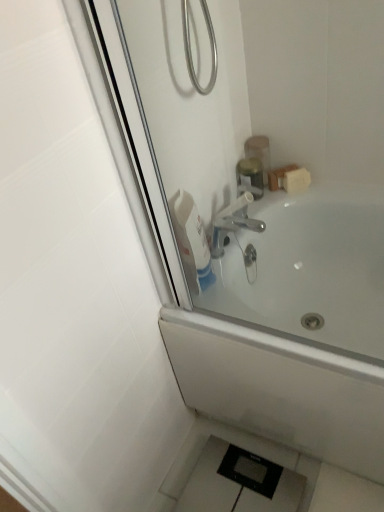
What is the approximate height of white glossy bottle at upper center?

The height of white glossy bottle at upper center is 9.73 inches.

What do you see at coordinates (192, 240) in the screenshot? I see `white glossy bottle at upper center` at bounding box center [192, 240].

Locate an element on the screen. white glossy bathtub at upper center is located at coordinates (295, 329).

Find the location of a particular element. The image size is (384, 512). metallic silver soap dispenser at upper right, which ranks as the second toiletry in top-to-bottom order is located at coordinates (250, 177).

Is white glossy bathtub at upper center further to camera compared to white glossy bottle at upper center?

No, it is not.

Which is behind, point (302, 231) or point (177, 238)?

The point (302, 231) is farther from the camera.

Is white glossy bathtub at upper center with white glossy bottle at upper center?

No, white glossy bathtub at upper center is not next to white glossy bottle at upper center.

Is white glossy bathtub at upper center oriented towards white glossy bottle at upper center?

No, white glossy bathtub at upper center is not turned towards white glossy bottle at upper center.

Which object is closer to the camera taking this photo, white glossy bottle at upper center or metallic gold container at upper center, which is the first toiletry in top-to-bottom order?

white glossy bottle at upper center is in front.

Based on their positions, is white glossy bottle at upper center located to the left or right of metallic gold container at upper center, marked as the second toiletry in a bottom-to-top arrangement?

white glossy bottle at upper center is to the left of metallic gold container at upper center, marked as the second toiletry in a bottom-to-top arrangement.

From the image's perspective, between white glossy bottle at upper center and metallic gold container at upper center, which is the first toiletry in top-to-bottom order, which one is located above?

From the image's view, metallic gold container at upper center, which is the first toiletry in top-to-bottom order, is above.

Which of these two, white glossy bottle at upper center or metallic gold container at upper center, which is the first toiletry in top-to-bottom order, is smaller?

Smaller between the two is metallic gold container at upper center, which is the first toiletry in top-to-bottom order.

Would you say metallic gold container at upper center, marked as the second toiletry in a bottom-to-top arrangement, is outside white glossy bottle at upper center?

That's correct, metallic gold container at upper center, marked as the second toiletry in a bottom-to-top arrangement, is outside of white glossy bottle at upper center.

How many degrees apart are the facing directions of metallic gold container at upper center, which is the first toiletry in top-to-bottom order, and white glossy bottle at upper center?

15.4 degrees.

Who is bigger, metallic gold container at upper center, marked as the second toiletry in a bottom-to-top arrangement, or white glossy bottle at upper center?

white glossy bottle at upper center is bigger.

Relative to white glossy bottle at upper center, is metallic gold container at upper center, marked as the second toiletry in a bottom-to-top arrangement, in front or behind?

In the image, metallic gold container at upper center, marked as the second toiletry in a bottom-to-top arrangement, appears behind white glossy bottle at upper center.

Is metallic silver soap dispenser at upper right, which ranks as the second toiletry in top-to-bottom order, completely or partially inside white glossy bottle at upper center?

Definitely not — metallic silver soap dispenser at upper right, which ranks as the second toiletry in top-to-bottom order, is not inside white glossy bottle at upper center.

Is white glossy bottle at upper center taller than metallic silver soap dispenser at upper right, which ranks as the second toiletry in top-to-bottom order?

Indeed, white glossy bottle at upper center has a greater height compared to metallic silver soap dispenser at upper right, which ranks as the second toiletry in top-to-bottom order.

From a real-world perspective, is white glossy bottle at upper center physically below metallic silver soap dispenser at upper right, arranged as the first toiletry when ordered from the bottom?

No, from a real-world perspective, white glossy bottle at upper center is not below metallic silver soap dispenser at upper right, arranged as the first toiletry when ordered from the bottom.

Is white glossy bottle at upper center directly adjacent to metallic silver soap dispenser at upper right, arranged as the first toiletry when ordered from the bottom?

No, white glossy bottle at upper center is not making contact with metallic silver soap dispenser at upper right, arranged as the first toiletry when ordered from the bottom.

Which of these two, metallic gold container at upper center, which is the first toiletry in top-to-bottom order, or white glossy bathtub at upper center, is wider?

Wider between the two is white glossy bathtub at upper center.

Can we say metallic gold container at upper center, marked as the second toiletry in a bottom-to-top arrangement, lies outside white glossy bathtub at upper center?

A: Yes, metallic gold container at upper center, marked as the second toiletry in a bottom-to-top arrangement, is not within white glossy bathtub at upper center.

Which of these two, metallic gold container at upper center, marked as the second toiletry in a bottom-to-top arrangement, or white glossy bathtub at upper center, is bigger?

With larger size is white glossy bathtub at upper center.

From a real-world perspective, starting from the white glossy bathtub at upper center, which toiletry is the 2nd one vertically above it? Please provide its 2D coordinates.

[(259, 152)]

Considering the positions of objects metallic silver soap dispenser at upper right, arranged as the first toiletry when ordered from the bottom, and white glossy bathtub at upper center in the image provided, who is more to the right, metallic silver soap dispenser at upper right, arranged as the first toiletry when ordered from the bottom, or white glossy bathtub at upper center?

Positioned to the right is white glossy bathtub at upper center.

Does point (251, 188) appear closer or farther from the camera than point (351, 322)?

Point (251, 188).

Would you say metallic silver soap dispenser at upper right, which ranks as the second toiletry in top-to-bottom order, is inside or outside white glossy bathtub at upper center?

metallic silver soap dispenser at upper right, which ranks as the second toiletry in top-to-bottom order, lies outside white glossy bathtub at upper center.

From the image's perspective, who appears lower, metallic silver soap dispenser at upper right, arranged as the first toiletry when ordered from the bottom, or white glossy bathtub at upper center?

white glossy bathtub at upper center, from the image's perspective.

Does metallic silver soap dispenser at upper right, arranged as the first toiletry when ordered from the bottom, appear on the right side of white glossy bottle at upper center?

Correct, you'll find metallic silver soap dispenser at upper right, arranged as the first toiletry when ordered from the bottom, to the right of white glossy bottle at upper center.

From the image's perspective, is metallic silver soap dispenser at upper right, which ranks as the second toiletry in top-to-bottom order, under white glossy bottle at upper center?

No, from the image's perspective, metallic silver soap dispenser at upper right, which ranks as the second toiletry in top-to-bottom order, is not below white glossy bottle at upper center.

Find the location of a particular element. cleaning product in front of the metallic silver soap dispenser at upper right, which ranks as the second toiletry in top-to-bottom order is located at coordinates (192, 240).

Identify the location of bathtub located on the right of white glossy bottle at upper center. (295, 329).

Locate an element on the screen. The width and height of the screenshot is (384, 512). cleaning product that is on the left side of metallic gold container at upper center, marked as the second toiletry in a bottom-to-top arrangement is located at coordinates (192, 240).

Based on the photo, considering their positions, is metallic silver soap dispenser at upper right, arranged as the first toiletry when ordered from the bottom, positioned further to metallic gold container at upper center, which is the first toiletry in top-to-bottom order, than white glossy bathtub at upper center?

white glossy bathtub at upper center lies further to metallic gold container at upper center, which is the first toiletry in top-to-bottom order, than the other object.

Considering their positions, is metallic silver soap dispenser at upper right, which ranks as the second toiletry in top-to-bottom order, positioned closer to white glossy bathtub at upper center than white glossy bottle at upper center?

Among the two, white glossy bottle at upper center is located nearer to white glossy bathtub at upper center.

Estimate the real-world distances between objects in this image. Which object is further from metallic silver soap dispenser at upper right, arranged as the first toiletry when ordered from the bottom, metallic gold container at upper center, which is the first toiletry in top-to-bottom order, or white glossy bathtub at upper center?

white glossy bathtub at upper center is positioned further to the anchor metallic silver soap dispenser at upper right, arranged as the first toiletry when ordered from the bottom.

Considering their positions, is metallic gold container at upper center, marked as the second toiletry in a bottom-to-top arrangement, positioned closer to white glossy bottle at upper center than white glossy bathtub at upper center?

white glossy bathtub at upper center.

Estimate the real-world distances between objects in this image. Which object is closer to metallic silver soap dispenser at upper right, arranged as the first toiletry when ordered from the bottom, white glossy bathtub at upper center or white glossy bottle at upper center?

white glossy bottle at upper center is closer to metallic silver soap dispenser at upper right, arranged as the first toiletry when ordered from the bottom.

Which object lies nearer to the anchor point metallic gold container at upper center, marked as the second toiletry in a bottom-to-top arrangement, white glossy bottle at upper center or white glossy bathtub at upper center?

white glossy bottle at upper center is positioned closer to the anchor metallic gold container at upper center, marked as the second toiletry in a bottom-to-top arrangement.

Considering their positions, is white glossy bathtub at upper center positioned closer to metallic silver soap dispenser at upper right, which ranks as the second toiletry in top-to-bottom order, than metallic gold container at upper center, which is the first toiletry in top-to-bottom order?

metallic gold container at upper center, which is the first toiletry in top-to-bottom order, is closer to metallic silver soap dispenser at upper right, which ranks as the second toiletry in top-to-bottom order.

Based on their spatial positions, is white glossy bottle at upper center or metallic silver soap dispenser at upper right, which ranks as the second toiletry in top-to-bottom order, closer to metallic gold container at upper center, which is the first toiletry in top-to-bottom order?

Among the two, metallic silver soap dispenser at upper right, which ranks as the second toiletry in top-to-bottom order, is located nearer to metallic gold container at upper center, which is the first toiletry in top-to-bottom order.

Image resolution: width=384 pixels, height=512 pixels. In order to click on cleaning product between white glossy bathtub at upper center and metallic silver soap dispenser at upper right, arranged as the first toiletry when ordered from the bottom, from front to back in this screenshot , I will do `click(192, 240)`.

Identify the location of toiletry positioned between white glossy bathtub at upper center and metallic gold container at upper center, which is the first toiletry in top-to-bottom order, from near to far. The image size is (384, 512). (250, 177).

I want to click on toiletry positioned between white glossy bottle at upper center and metallic gold container at upper center, which is the first toiletry in top-to-bottom order, from near to far, so click(250, 177).

Locate an element on the screen. The height and width of the screenshot is (512, 384). cleaning product between white glossy bathtub at upper center and metallic gold container at upper center, marked as the second toiletry in a bottom-to-top arrangement, along the z-axis is located at coordinates (192, 240).